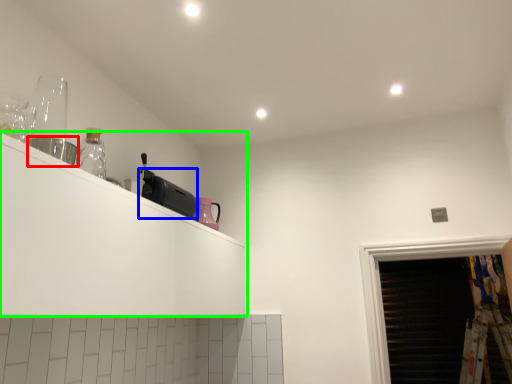
Question: Based on their relative distances, which object is nearer to appliance (highlighted by a red box)? Choose from appliance (highlighted by a blue box) and shelf (highlighted by a green box).

Choices:
 (A) appliance
 (B) shelf

Answer: (B)